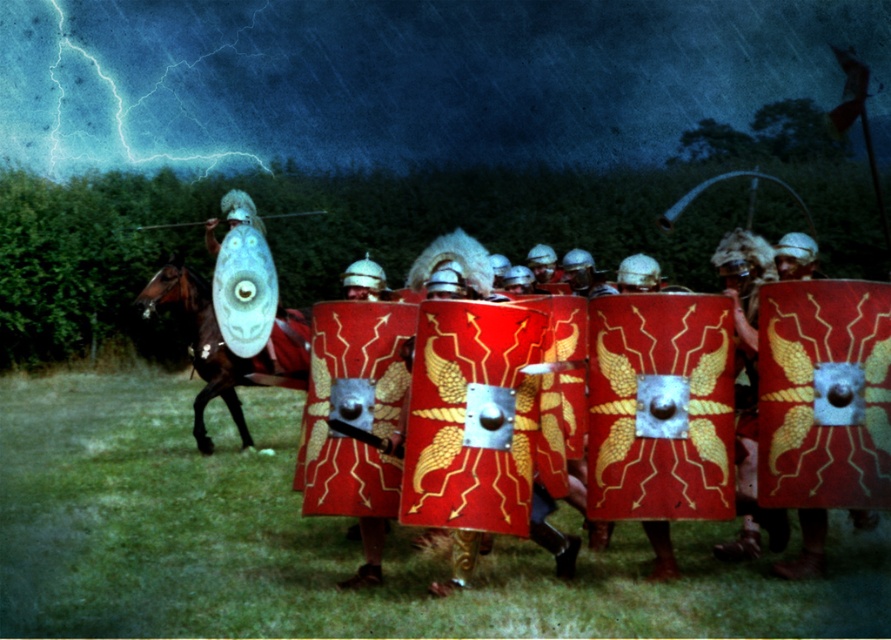
You are a soldier in the Roman formation. You need to retrieve your shield from the center. However, there is a horse blocking your path. Can you safely walk around the shiny brown horse at left to reach the translucent plastic shield at center without getting too close?

The shiny brown horse at left is much taller than the translucent plastic shield at center, so you can safely walk around the horse to reach the shield without getting too close.

You are a soldier in the formation. You need to move to the right to avoid the lightning strike. Which direction should you move relative to the shiny brown horse at left and the translucent plastic shield at center?

You should move to the right of the translucent plastic shield at center, which is to the right of the shiny brown horse at left. Since the shield is at the center and the horse is to its left, moving right from the shield would take you away from the lightning strike.

Based on the photo, you are a soldier in the Roman formation. You notice the shiny brown horse at left and the translucent plastic shield at center. Which object is larger in size?

The shiny brown horse at left is bigger than the translucent plastic shield at center.